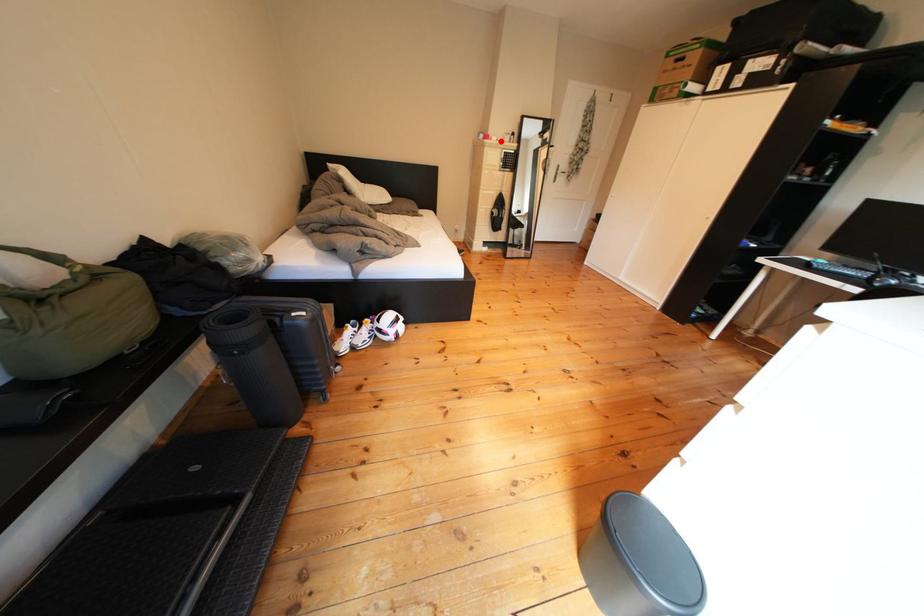
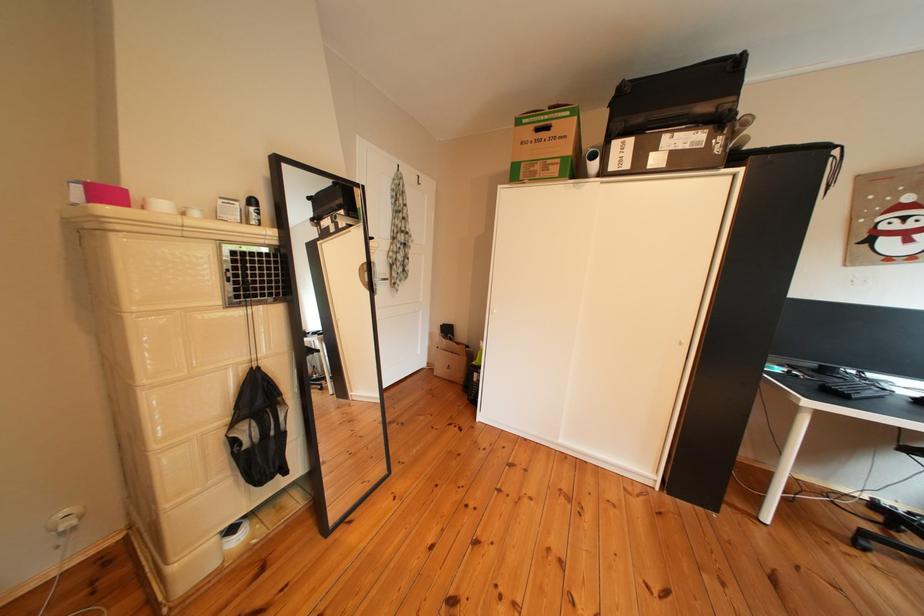
Question: I am providing you with two images of the same scene from different viewpoints. A red point is shown in image1. For the corresponding object point in image2, is it positioned nearer or farther from the camera?

Choices:
 (A) Nearer
 (B) Farther

Answer: (B)